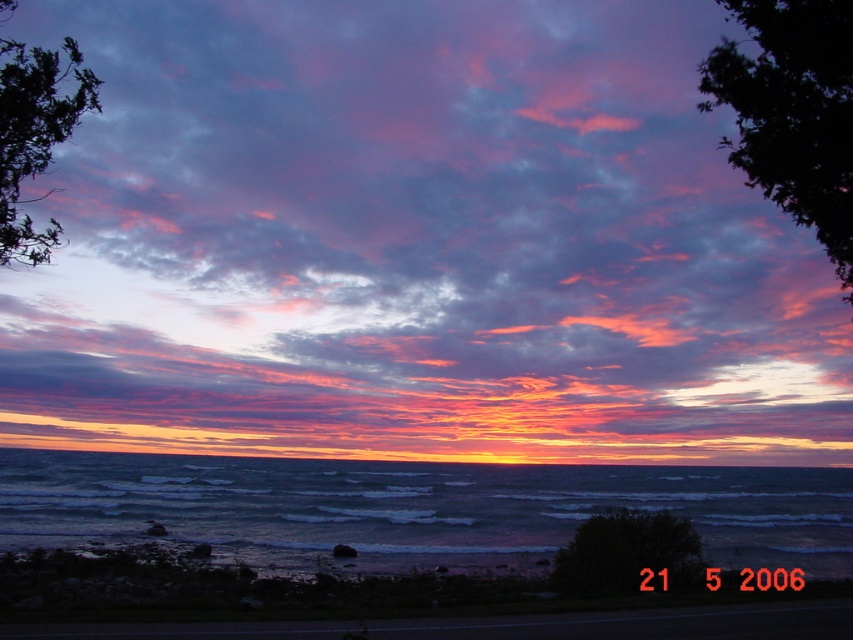
Can you confirm if vivid pink cotton clouds at center is positioned to the right of smooth sand shoreline at lower center?

In fact, vivid pink cotton clouds at center is to the left of smooth sand shoreline at lower center.

Does vivid pink cotton clouds at center appear over smooth sand shoreline at lower center?

Indeed, vivid pink cotton clouds at center is positioned over smooth sand shoreline at lower center.

What do you see at coordinates (415, 244) in the screenshot?
I see `vivid pink cotton clouds at center` at bounding box center [415, 244].

Where is `vivid pink cotton clouds at center`? The width and height of the screenshot is (853, 640). vivid pink cotton clouds at center is located at coordinates (415, 244).

The width and height of the screenshot is (853, 640). Describe the element at coordinates (415, 506) in the screenshot. I see `teal water at lower center` at that location.

Between point (97, 458) and point (596, 620), which one is positioned in front?

Point (596, 620)

Which is behind, point (714, 513) or point (114, 611)?

Point (714, 513)

The height and width of the screenshot is (640, 853). What are the coordinates of `teal water at lower center` in the screenshot? It's located at (415, 506).

Does point (587, 216) come closer to viewer compared to point (165, 499)?

No, (587, 216) is behind (165, 499).

Consider the image. Is vivid pink cotton clouds at center to the right of teal water at lower center from the viewer's perspective?

Correct, you'll find vivid pink cotton clouds at center to the right of teal water at lower center.

Is point (383, 417) farther from viewer compared to point (749, 524)?

Yes, it is behind point (749, 524).

Identify the location of vivid pink cotton clouds at center. (415, 244).